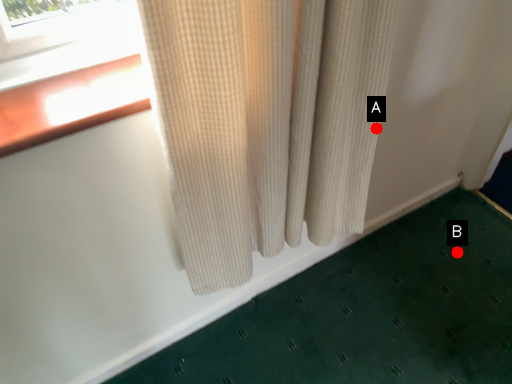
Question: Two points are circled on the image, labeled by A and B beside each circle. Which point is closer to the camera taking this photo?

Choices:
 (A) A is closer
 (B) B is closer

Answer: (A)